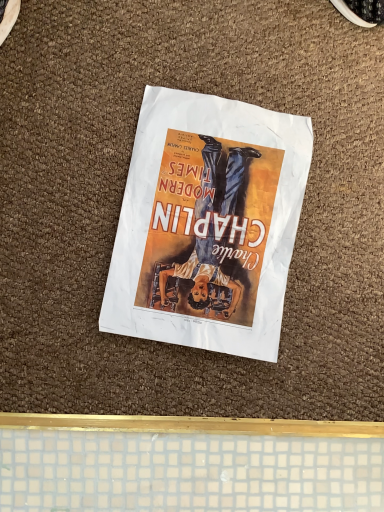
Find the location of `vacant area on top of matte paper poster at center (from a real-world perspective)`. vacant area on top of matte paper poster at center (from a real-world perspective) is located at coordinates (211, 218).